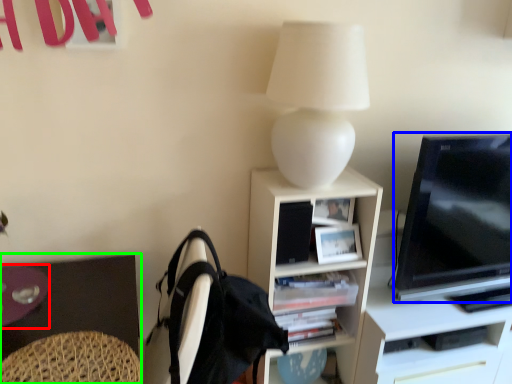
Question: Which object is positioned farthest from glass table (highlighted by a red box)? Select from television (highlighted by a blue box) and desk (highlighted by a green box).

Choices:
 (A) television
 (B) desk

Answer: (A)